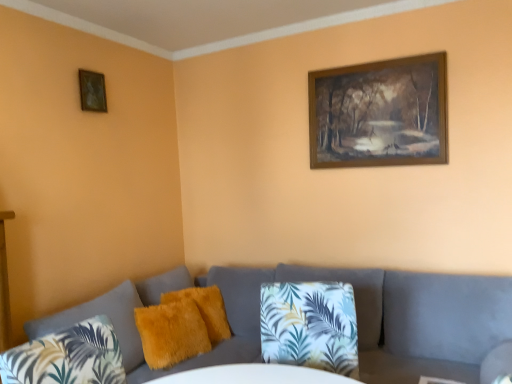
Question: From a real-world perspective, does wooden frame at upper right, acting as the 2th picture frame starting from the left, sit lower than velvet grey couch at lower center?

Choices:
 (A) no
 (B) yes

Answer: (A)

Question: From the image's perspective, is wooden frame at upper right, acting as the 2th picture frame starting from the left, on velvet grey couch at lower center?

Choices:
 (A) yes
 (B) no

Answer: (A)

Question: From a real-world perspective, is wooden frame at upper right, the 1th picture frame from the right, over velvet grey couch at lower center?

Choices:
 (A) yes
 (B) no

Answer: (A)

Question: Does wooden frame at upper right, the 1th picture frame from the right, have a smaller size compared to velvet grey couch at lower center?

Choices:
 (A) yes
 (B) no

Answer: (A)

Question: Is the depth of wooden frame at upper right, the 1th picture frame from the right, greater than that of velvet grey couch at lower center?

Choices:
 (A) no
 (B) yes

Answer: (B)

Question: Is velvet grey couch at lower center taller or shorter than wooden picture frame at upper left, the first picture frame when ordered from left to right?

Choices:
 (A) short
 (B) tall

Answer: (B)

Question: From a real-world perspective, is velvet grey couch at lower center positioned above or below wooden picture frame at upper left, the first picture frame when ordered from left to right?

Choices:
 (A) above
 (B) below

Answer: (B)

Question: From the image's perspective, relative to wooden picture frame at upper left, arranged as the second picture frame when viewed from the right, is velvet grey couch at lower center above or below?

Choices:
 (A) below
 (B) above

Answer: (A)

Question: Looking at their shapes, would you say velvet grey couch at lower center is wider or thinner than wooden picture frame at upper left, the first picture frame when ordered from left to right?

Choices:
 (A) thin
 (B) wide

Answer: (B)

Question: Looking at their shapes, would you say fuzzy yellow pillow at center, positioned as the 1th pillow in back-to-front order, is wider or thinner than wooden frame at upper right, the 1th picture frame from the right?

Choices:
 (A) thin
 (B) wide

Answer: (B)

Question: Considering their positions, is fuzzy yellow pillow at center, arranged as the third pillow when viewed from the front, located in front of or behind wooden frame at upper right, acting as the 2th picture frame starting from the left?

Choices:
 (A) front
 (B) behind

Answer: (B)

Question: Is fuzzy yellow pillow at center, positioned as the 1th pillow in back-to-front order, to the left or to the right of wooden frame at upper right, the 1th picture frame from the right, in the image?

Choices:
 (A) right
 (B) left

Answer: (B)

Question: Is fuzzy yellow pillow at center, arranged as the third pillow when viewed from the front, inside or outside of wooden frame at upper right, acting as the 2th picture frame starting from the left?

Choices:
 (A) inside
 (B) outside

Answer: (B)

Question: Is point (170, 312) positioned closer to the camera than point (40, 327)?

Choices:
 (A) farther
 (B) closer

Answer: (A)

Question: Choose the correct answer: Is fuzzy yellow pillow at center, which appears as the 2th pillow when viewed from the front, inside velvet grey couch at lower center or outside it?

Choices:
 (A) outside
 (B) inside

Answer: (B)